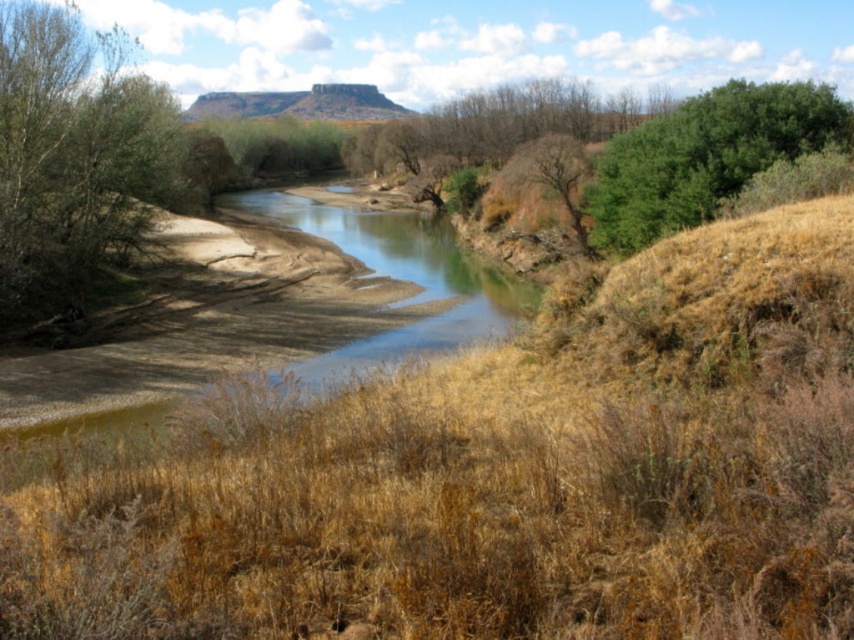
Question: Which object appears farthest from the camera in this image?

Choices:
 (A) brown dry grass at center
 (B) green leafy tree at upper right
 (C) green leafy tree at left

Answer: (C)

Question: Is the position of brown dry grass at center more distant than that of green leafy tree at upper right?

Choices:
 (A) yes
 (B) no

Answer: (B)

Question: Does brown dry grass at center appear on the left side of green leafy tree at upper right?

Choices:
 (A) no
 (B) yes

Answer: (B)

Question: Which object appears closest to the camera in this image?

Choices:
 (A) green leafy tree at left
 (B) green leafy tree at upper right

Answer: (B)

Question: Which point appears closest to the camera in this image?

Choices:
 (A) (51, 198)
 (B) (697, 276)
 (C) (668, 124)

Answer: (B)

Question: Does green leafy tree at left appear over green leafy tree at upper right?

Choices:
 (A) yes
 (B) no

Answer: (B)